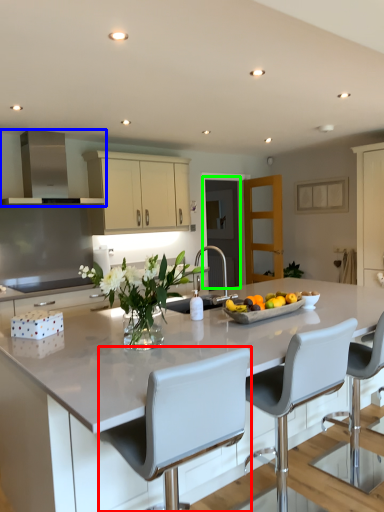
Question: Which object is the farthest from chair (highlighted by a red box)? Choose among these: exhaust hood (highlighted by a blue box) or glass door (highlighted by a green box).

Choices:
 (A) exhaust hood
 (B) glass door

Answer: (B)